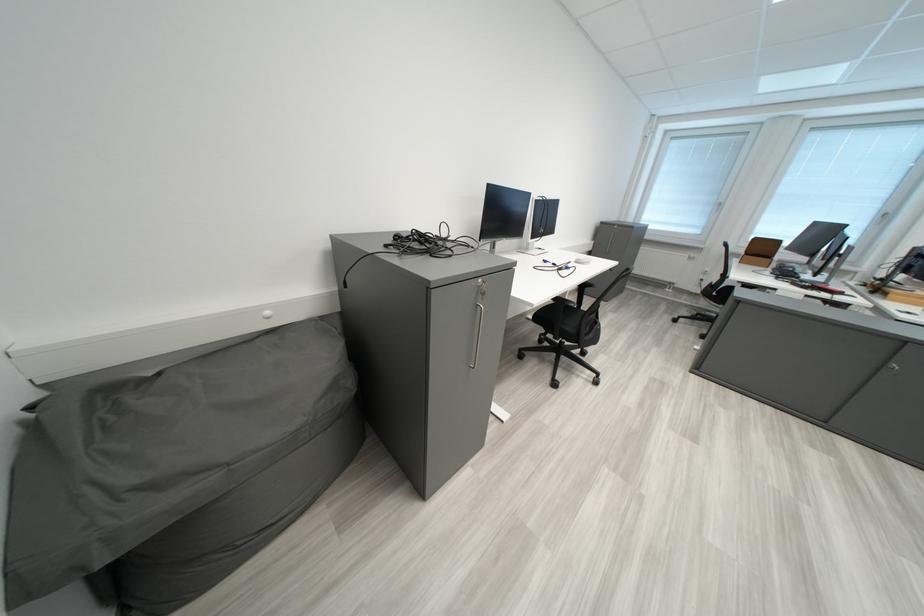
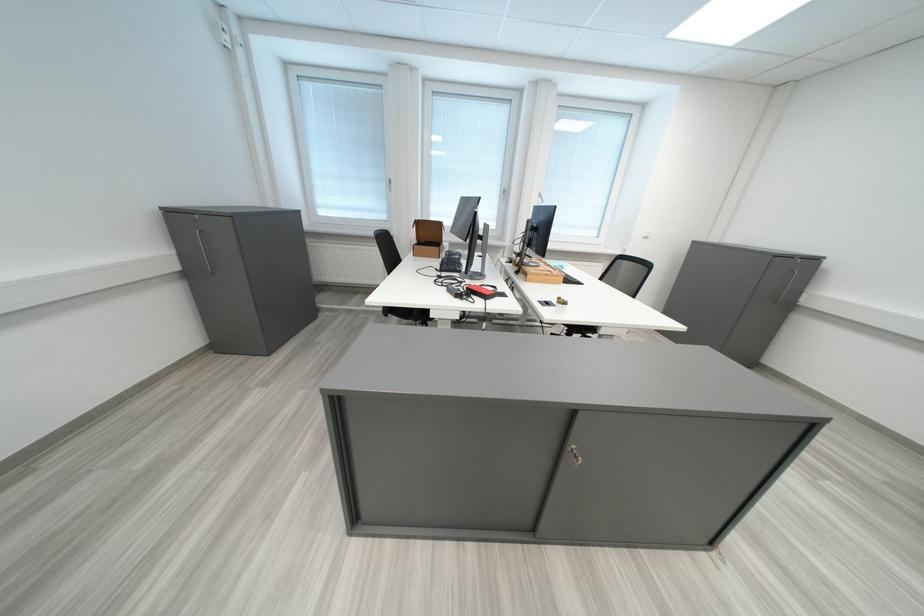
In the second image, find the point that corresponds to (x=829, y=291) in the first image.

(483, 294)